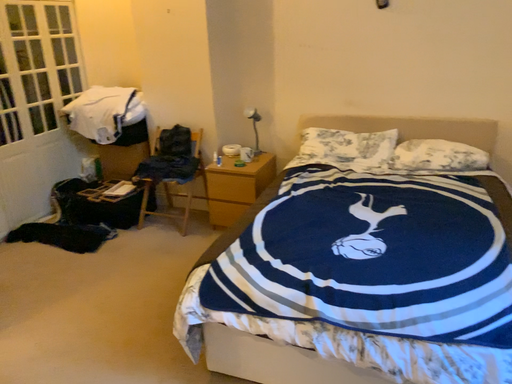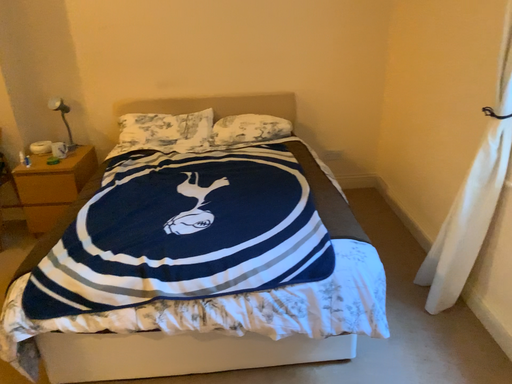
Question: Which way did the camera rotate in the video?

Choices:
 (A) rotated right
 (B) rotated left

Answer: (A)